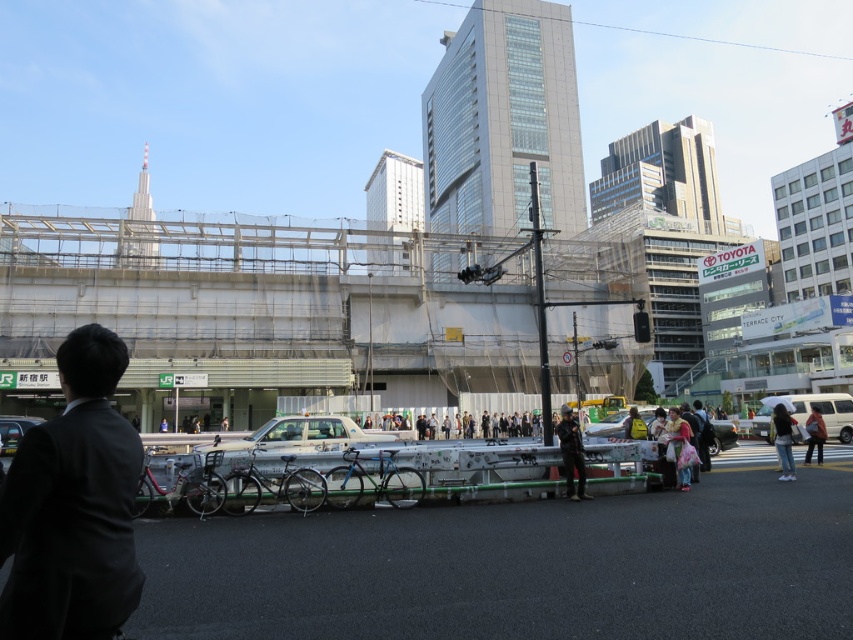
Question: Is light pink fabric bag at lower right bigger than matte pink backpack at lower right?

Choices:
 (A) no
 (B) yes

Answer: (A)

Question: Can you confirm if metallic gray overpass at upper center is positioned above yellow matte car at center?

Choices:
 (A) no
 (B) yes

Answer: (B)

Question: Which object is the farthest from the jeans at lower right?

Choices:
 (A) white glossy taxi at center
 (B) white matte van at right
 (C) metallic gray overpass at upper center

Answer: (C)

Question: Which object is closer to the camera taking this photo?

Choices:
 (A) white glossy taxi at center
 (B) jeans at lower right
 (C) shiny black car at lower left
 (D) black suit at lower left

Answer: (D)

Question: Which object appears closest to the camera in this image?

Choices:
 (A) metallic gray overpass at upper center
 (B) metallic silver car at center
 (C) light pink fabric bag at lower right
 (D) yellow matte car at center

Answer: (C)

Question: Can you confirm if white glossy taxi at center is thinner than yellow matte car at center?

Choices:
 (A) yes
 (B) no

Answer: (B)